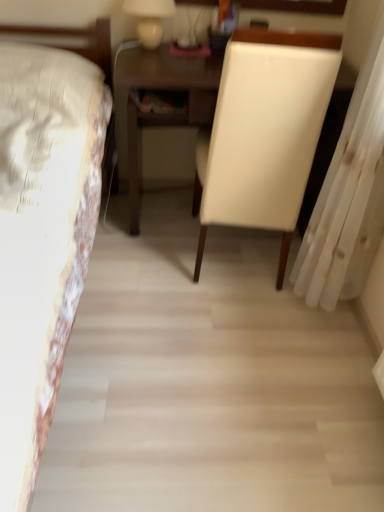
Locate an element on the screen. Image resolution: width=384 pixels, height=512 pixels. free point in front of white sheer curtain at right is located at coordinates (323, 395).